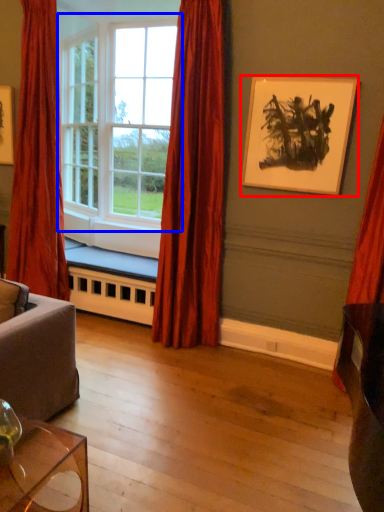
Question: Which point is further to the camera, picture frame (highlighted by a red box) or window (highlighted by a blue box)?

Choices:
 (A) picture frame
 (B) window

Answer: (B)